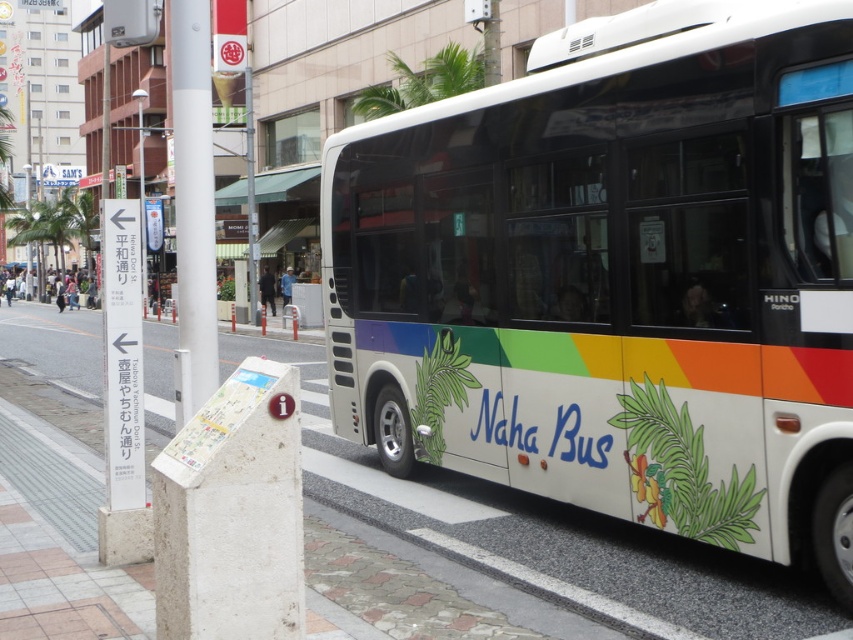
Question: Is white glossy bus at right below white concrete pavement at lower center?

Choices:
 (A) yes
 (B) no

Answer: (A)

Question: Considering the relative positions of white glossy bus at right and white concrete pavement at lower center in the image provided, where is white glossy bus at right located with respect to white concrete pavement at lower center?

Choices:
 (A) below
 (B) above

Answer: (A)

Question: Can you confirm if white glossy bus at right is positioned below white concrete pavement at lower center?

Choices:
 (A) yes
 (B) no

Answer: (A)

Question: Among these objects, which one is nearest to the camera?

Choices:
 (A) white glossy bus at right
 (B) white concrete pavement at lower center

Answer: (B)

Question: Among these points, which one is farthest from the camera?

Choices:
 (A) (750, 131)
 (B) (715, 576)

Answer: (B)